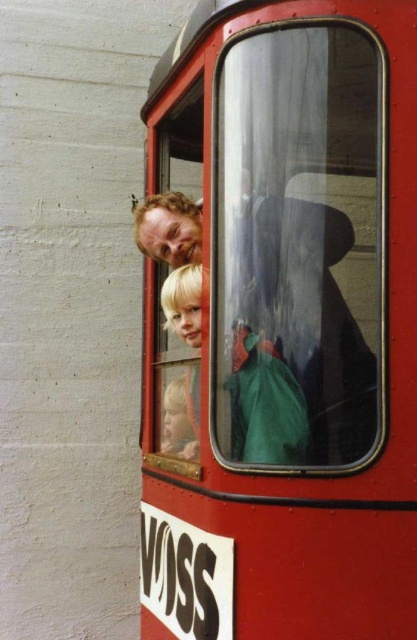
Question: Is metallic red train car at center below blonde hair child at center?

Choices:
 (A) yes
 (B) no

Answer: (B)

Question: Can you confirm if metallic red train car at center is thinner than blonde hair child at center?

Choices:
 (A) yes
 (B) no

Answer: (B)

Question: Does metallic red train car at center appear over blonde hair child at center?

Choices:
 (A) yes
 (B) no

Answer: (A)